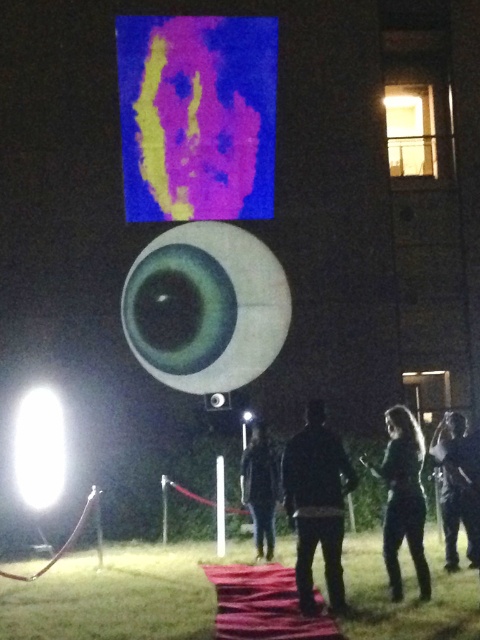
Is purple felt-like screen at upper center thinner than dark green leather jacket at lower center?

No.

Is point (268, 90) positioned in front of point (404, 426)?

No, it is not.

This screenshot has width=480, height=640. Find the location of `purple felt-like screen at upper center`. purple felt-like screen at upper center is located at coordinates (196, 116).

Is point (417, 454) positioned before point (273, 452)?

Yes, it is.

Does dark green leather jacket at lower center come behind dark fabric jacket at center?

That is False.

Is point (394, 538) positioned after point (257, 426)?

No, (394, 538) is in front of (257, 426).

This screenshot has height=640, width=480. Identify the location of dark green leather jacket at lower center. click(403, 497).

Is purple felt-like screen at upper center positioned in front of dark gray hoodie at center?

That is False.

This screenshot has width=480, height=640. In order to click on purple felt-like screen at upper center in this screenshot , I will do `click(196, 116)`.

Measure the distance between purple felt-like screen at upper center and camera.

The distance of purple felt-like screen at upper center from camera is 46.33 feet.

Where is `purple felt-like screen at upper center`? The image size is (480, 640). purple felt-like screen at upper center is located at coordinates (196, 116).